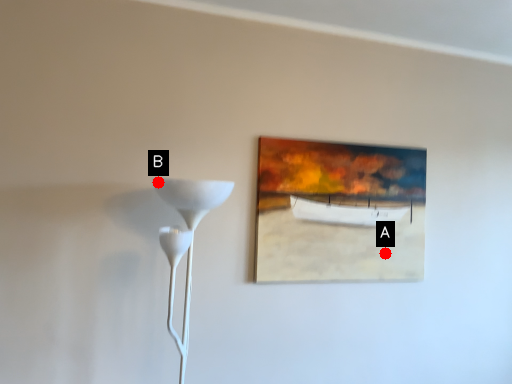
Question: Two points are circled on the image, labeled by A and B beside each circle. Which of the following is the closest to the observer?

Choices:
 (A) A is closer
 (B) B is closer

Answer: (B)